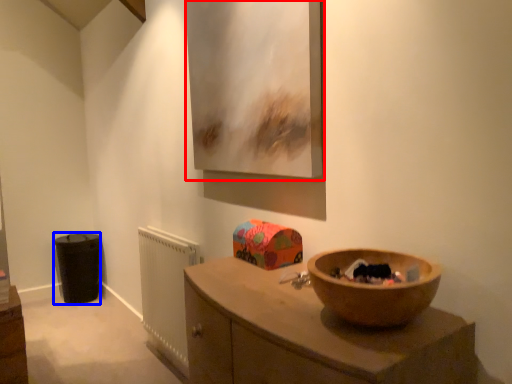
Question: Among these objects, which one is farthest to the camera, picture frame (highlighted by a red box) or cabinetry (highlighted by a blue box)?

Choices:
 (A) picture frame
 (B) cabinetry

Answer: (B)